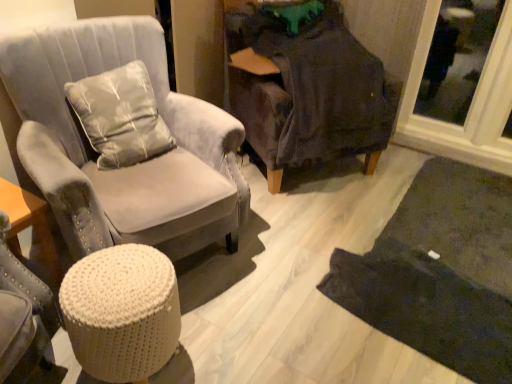
You are a GUI agent. You are given a task and a screenshot of the screen. Output one action in this format:
    pyautogui.click(x=<x>, y=<y>)
    Task: Click on the white knitted stool at lower left
    
    Given the screenshot: What is the action you would take?
    pyautogui.click(x=122, y=312)

This screenshot has height=384, width=512. What do you see at coordinates (440, 272) in the screenshot? I see `dark gray textured mat at lower right` at bounding box center [440, 272].

What is the approximate height of dark gray textured mat at lower right?

dark gray textured mat at lower right is 2.40 inches in height.

What do you see at coordinates (306, 89) in the screenshot?
I see `dark gray fabric chair at center, marked as the 1th chair in a right-to-left arrangement` at bounding box center [306, 89].

What do you see at coordinates (128, 167) in the screenshot?
I see `suede gray armchair at left, which is counted as the first chair, starting from the left` at bounding box center [128, 167].

Describe the element at coordinates (120, 116) in the screenshot. I see `satin-like gray pillow at upper left` at that location.

Where is `transparent glass door at upper right`? This screenshot has height=384, width=512. transparent glass door at upper right is located at coordinates (472, 102).

At what (x,y) coordinates should I click in order to perform the action: click on white knitted stool at lower left. Please return your answer as a coordinate pair (x, y). The width and height of the screenshot is (512, 384). Looking at the image, I should click on (122, 312).

Is white knitted stool at lower left in contact with satin-like gray pillow at upper left?

No, white knitted stool at lower left is not making contact with satin-like gray pillow at upper left.

How much distance is there between white knitted stool at lower left and satin-like gray pillow at upper left?

A distance of 23.93 inches exists between white knitted stool at lower left and satin-like gray pillow at upper left.

Is white knitted stool at lower left to the right of satin-like gray pillow at upper left from the viewer's perspective?

Correct, you'll find white knitted stool at lower left to the right of satin-like gray pillow at upper left.

From the picture: Is white knitted stool at lower left aimed at satin-like gray pillow at upper left?

No, white knitted stool at lower left is not oriented towards satin-like gray pillow at upper left.

Visually, is suede gray armchair at left, which is counted as the first chair, starting from the left, positioned to the left or to the right of dark gray fabric chair at center, acting as the second chair starting from the left?

Clearly, suede gray armchair at left, which is counted as the first chair, starting from the left, is on the left of dark gray fabric chair at center, acting as the second chair starting from the left, in the image.

Is suede gray armchair at left, which is counted as the first chair, starting from the left, further to camera compared to dark gray fabric chair at center, acting as the second chair starting from the left?

No, suede gray armchair at left, which is counted as the first chair, starting from the left, is closer to the camera.

Where is `chair lying on the right of suede gray armchair at left, which is the 2th chair in right-to-left order`? chair lying on the right of suede gray armchair at left, which is the 2th chair in right-to-left order is located at coordinates (306, 89).

From a real-world perspective, does suede gray armchair at left, which is the 2th chair in right-to-left order, stand above dark gray fabric chair at center, acting as the second chair starting from the left?

Indeed, from a real-world perspective, suede gray armchair at left, which is the 2th chair in right-to-left order, stands above dark gray fabric chair at center, acting as the second chair starting from the left.

Based on the photo, in terms of width, does white knitted stool at lower left look wider or thinner when compared to transparent glass door at upper right?

In the image, white knitted stool at lower left appears to be wider than transparent glass door at upper right.

Can you see white knitted stool at lower left touching transparent glass door at upper right?

No, white knitted stool at lower left is not making contact with transparent glass door at upper right.

Can we say white knitted stool at lower left lies outside transparent glass door at upper right?

Yes, white knitted stool at lower left is outside of transparent glass door at upper right.

How many degrees apart are the facing directions of white knitted stool at lower left and transparent glass door at upper right?

There is a 87-degree angle between the facing directions of white knitted stool at lower left and transparent glass door at upper right.

This screenshot has width=512, height=384. I want to click on glass door located behind the suede gray armchair at left, which is the 2th chair in right-to-left order, so click(472, 102).

Would you say suede gray armchair at left, which is counted as the first chair, starting from the left, is inside or outside transparent glass door at upper right?

suede gray armchair at left, which is counted as the first chair, starting from the left, cannot be found inside transparent glass door at upper right.

Based on the photo, which of these two, suede gray armchair at left, which is the 2th chair in right-to-left order, or transparent glass door at upper right, is smaller?

transparent glass door at upper right is smaller.

Which point is more distant from viewer, (59, 216) or (417, 49)?

The point (417, 49) is farther from the camera.

Does transparent glass door at upper right lie in front of satin-like gray pillow at upper left?

No.

Is transparent glass door at upper right facing towards satin-like gray pillow at upper left?

No.

Is transparent glass door at upper right to the left or to the right of satin-like gray pillow at upper left in the image?

In the image, transparent glass door at upper right appears on the right side of satin-like gray pillow at upper left.

From the image's perspective, is white knitted stool at lower left located above or below dark gray fabric chair at center, marked as the 1th chair in a right-to-left arrangement?

From the image's perspective, white knitted stool at lower left appears below dark gray fabric chair at center, marked as the 1th chair in a right-to-left arrangement.

Is white knitted stool at lower left with dark gray fabric chair at center, marked as the 1th chair in a right-to-left arrangement?

No, white knitted stool at lower left is not next to dark gray fabric chair at center, marked as the 1th chair in a right-to-left arrangement.

Consider the image. Is dark gray fabric chair at center, marked as the 1th chair in a right-to-left arrangement, surrounded by white knitted stool at lower left?

No, dark gray fabric chair at center, marked as the 1th chair in a right-to-left arrangement, is not inside white knitted stool at lower left.

From a real-world perspective, is transparent glass door at upper right positioned over dark gray textured mat at lower right based on gravity?

Correct, in the physical world, transparent glass door at upper right is higher than dark gray textured mat at lower right.

Can dark gray textured mat at lower right be found inside transparent glass door at upper right?

That's incorrect, dark gray textured mat at lower right is not inside transparent glass door at upper right.

How different are the orientations of transparent glass door at upper right and dark gray textured mat at lower right in degrees?

They differ by 0.852 degrees in their facing directions.

Is transparent glass door at upper right wider than dark gray textured mat at lower right?

No, transparent glass door at upper right is not wider than dark gray textured mat at lower right.

Locate an element on the screen. Image resolution: width=512 pixels, height=384 pixels. stool on the right of the satin-like gray pillow at upper left is located at coordinates (122, 312).

Where is `chair behind the suede gray armchair at left, which is the 2th chair in right-to-left order`? This screenshot has height=384, width=512. chair behind the suede gray armchair at left, which is the 2th chair in right-to-left order is located at coordinates (306, 89).

Consider the image. When comparing their distances from white knitted stool at lower left, does suede gray armchair at left, which is the 2th chair in right-to-left order, or transparent glass door at upper right seem closer?

Based on the image, suede gray armchair at left, which is the 2th chair in right-to-left order, appears to be nearer to white knitted stool at lower left.

Estimate the real-world distances between objects in this image. Which object is closer to white knitted stool at lower left, dark gray fabric chair at center, marked as the 1th chair in a right-to-left arrangement, or satin-like gray pillow at upper left?

satin-like gray pillow at upper left.

Considering their positions, is suede gray armchair at left, which is counted as the first chair, starting from the left, positioned further to dark gray fabric chair at center, acting as the second chair starting from the left, than transparent glass door at upper right?

The object further to dark gray fabric chair at center, acting as the second chair starting from the left, is transparent glass door at upper right.

From the picture: Considering their positions, is suede gray armchair at left, which is counted as the first chair, starting from the left, positioned closer to white knitted stool at lower left than dark gray fabric chair at center, marked as the 1th chair in a right-to-left arrangement?

suede gray armchair at left, which is counted as the first chair, starting from the left, is positioned closer to the anchor white knitted stool at lower left.

Which object lies nearer to the anchor point dark gray fabric chair at center, marked as the 1th chair in a right-to-left arrangement, transparent glass door at upper right or satin-like gray pillow at upper left?

transparent glass door at upper right is positioned closer to the anchor dark gray fabric chair at center, marked as the 1th chair in a right-to-left arrangement.

Based on their spatial positions, is suede gray armchair at left, which is the 2th chair in right-to-left order, or satin-like gray pillow at upper left closer to dark gray fabric chair at center, marked as the 1th chair in a right-to-left arrangement?

suede gray armchair at left, which is the 2th chair in right-to-left order, is closer to dark gray fabric chair at center, marked as the 1th chair in a right-to-left arrangement.

Based on their spatial positions, is satin-like gray pillow at upper left or suede gray armchair at left, which is the 2th chair in right-to-left order, closer to dark gray fabric chair at center, acting as the second chair starting from the left?

suede gray armchair at left, which is the 2th chair in right-to-left order, is closer to dark gray fabric chair at center, acting as the second chair starting from the left.

Looking at this image, considering their positions, is suede gray armchair at left, which is the 2th chair in right-to-left order, positioned closer to satin-like gray pillow at upper left than white knitted stool at lower left?

suede gray armchair at left, which is the 2th chair in right-to-left order, lies closer to satin-like gray pillow at upper left than the other object.

You are a GUI agent. You are given a task and a screenshot of the screen. Output one action in this format:
    pyautogui.click(x=<x>, y=<y>)
    Task: Click on the chair between suede gray armchair at left, which is the 2th chair in right-to-left order, and transparent glass door at upper right from left to right
    
    Given the screenshot: What is the action you would take?
    pyautogui.click(x=306, y=89)

Find the location of a particular element. This screenshot has height=384, width=512. mat between satin-like gray pillow at upper left and transparent glass door at upper right in the horizontal direction is located at coordinates (440, 272).

This screenshot has width=512, height=384. Identify the location of chair between dark gray fabric chair at center, acting as the second chair starting from the left, and white knitted stool at lower left vertically. (128, 167).

Where is `chair between suede gray armchair at left, which is counted as the first chair, starting from the left, and dark gray textured mat at lower right from left to right`? This screenshot has width=512, height=384. chair between suede gray armchair at left, which is counted as the first chair, starting from the left, and dark gray textured mat at lower right from left to right is located at coordinates (x=306, y=89).